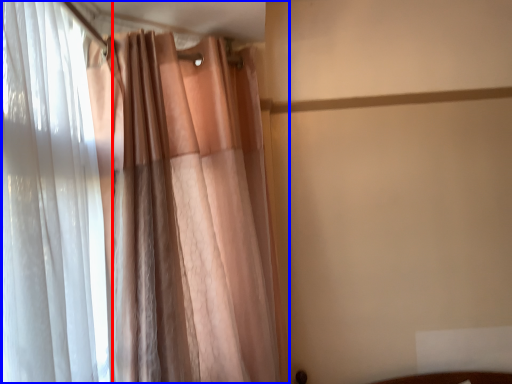
Question: Which of the following is the closest to the observer, curtain (highlighted by a red box) or curtain (highlighted by a blue box)?

Choices:
 (A) curtain
 (B) curtain

Answer: (A)